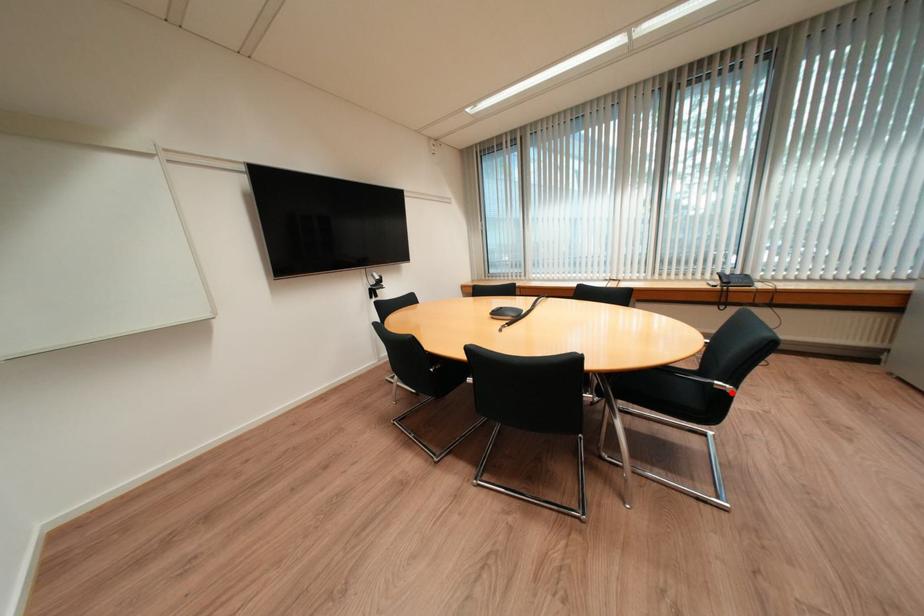
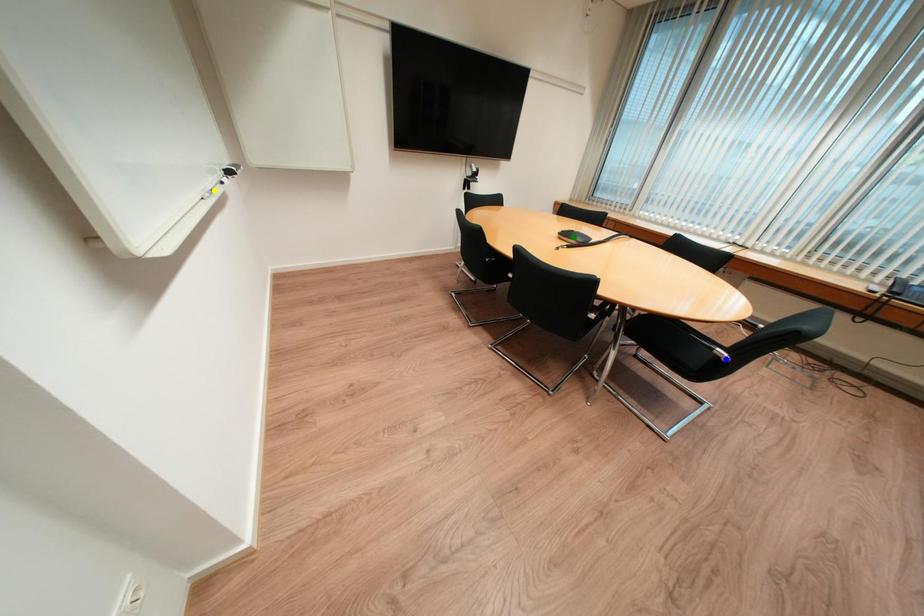
Question: I am providing you with two images of the same scene from different viewpoints. A red point is marked on the first image. You are given multiple points on the second image. Which mark in image 2 goes with the point in image 1?

Choices:
 (A) green point
 (B) yellow point
 (C) blue point

Answer: (C)